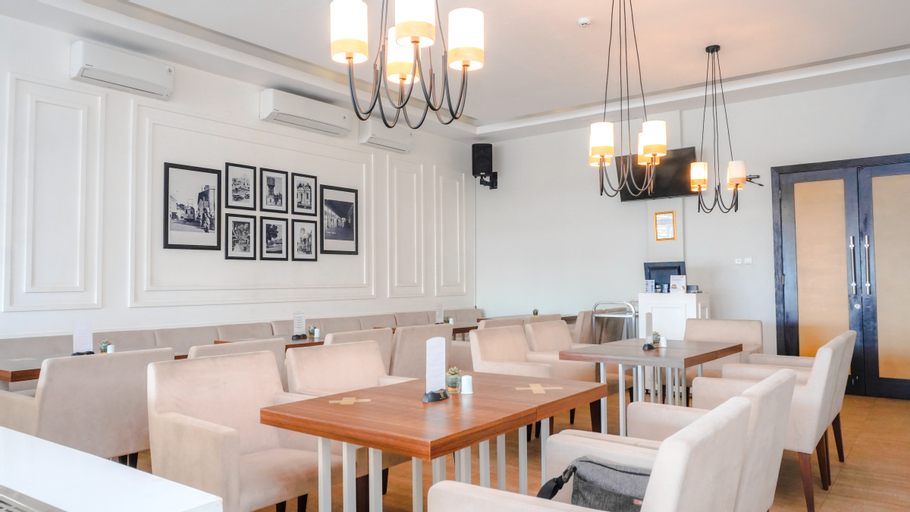
You are a GUI agent. You are given a task and a screenshot of the screen. Output one action in this format:
    pyautogui.click(x=<x>, y=<y>)
    Task: Click on the tables
    
    Given the screenshot: What is the action you would take?
    pyautogui.click(x=413, y=430), pyautogui.click(x=672, y=354), pyautogui.click(x=22, y=360), pyautogui.click(x=180, y=355), pyautogui.click(x=306, y=340), pyautogui.click(x=467, y=328), pyautogui.click(x=390, y=327), pyautogui.click(x=479, y=317), pyautogui.click(x=571, y=315)